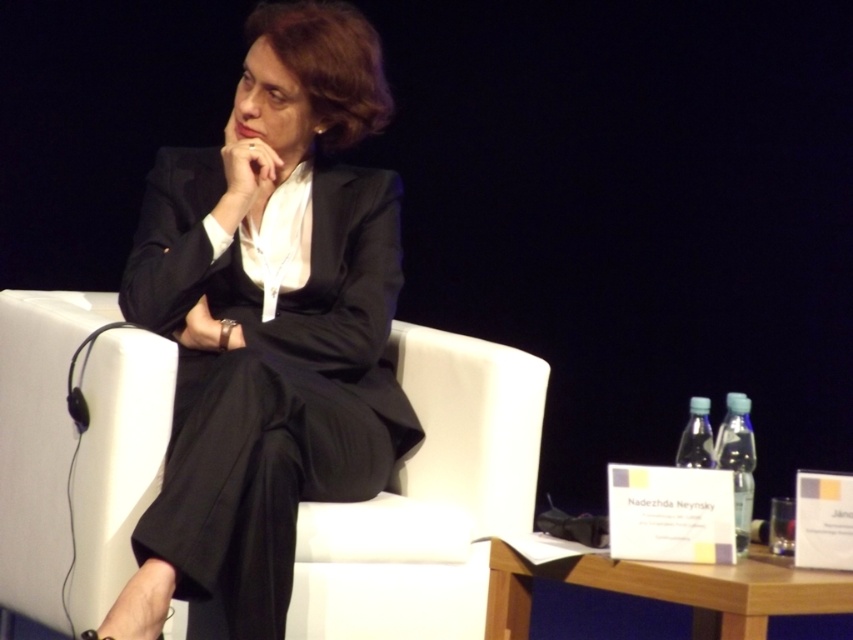
Looking at this image, you are designing a new office space and need to ensure there is enough room between the black pinstripe suit at center and the white fabric armchair at center for a person to comfortably sit. Based on the image, can you determine if there is sufficient space?

The black pinstripe suit at center is wider than the white fabric armchair at center, so there might not be enough space between them for a person to comfortably sit. Please consider adjusting their positions or choosing a narrower suit.

You are an interior designer planning to place a new sofa in a room. The sofa you want to choose is the same size as the black pinstripe suit at center. The space available is only enough for an object the size of the white fabric armchair at center. Will the sofa fit?

The black pinstripe suit at center is larger than the white fabric armchair at center. Therefore, the sofa will not fit in the available space.

You are an interior designer planning to place a new lamp next to the black pinstripe suit at center. According to the coordinates provided, where should the lamp be positioned relative to the suit?

The black pinstripe suit at center is located at point (268, 323), so the lamp should be placed to the right of the black pinstripe suit at center since the coordinates indicate its position.